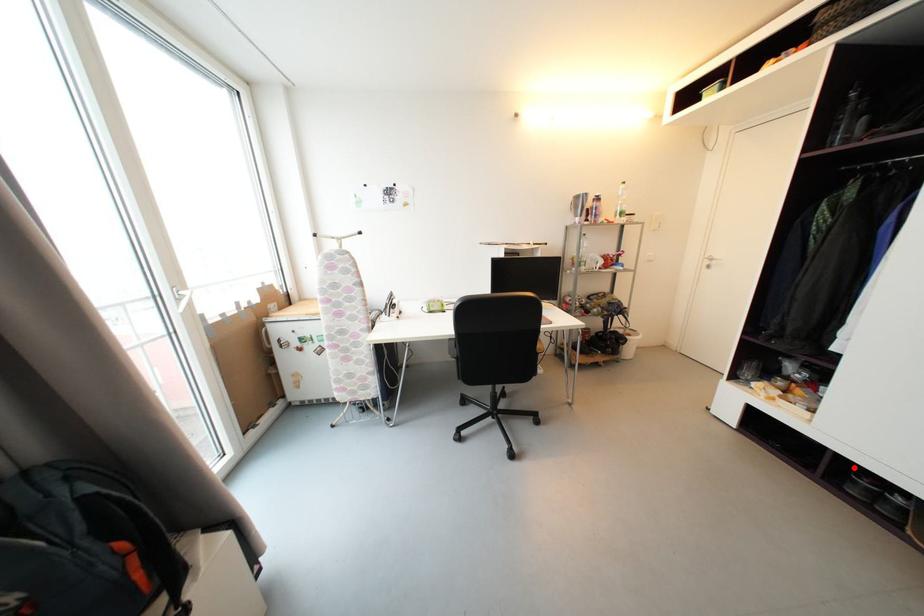
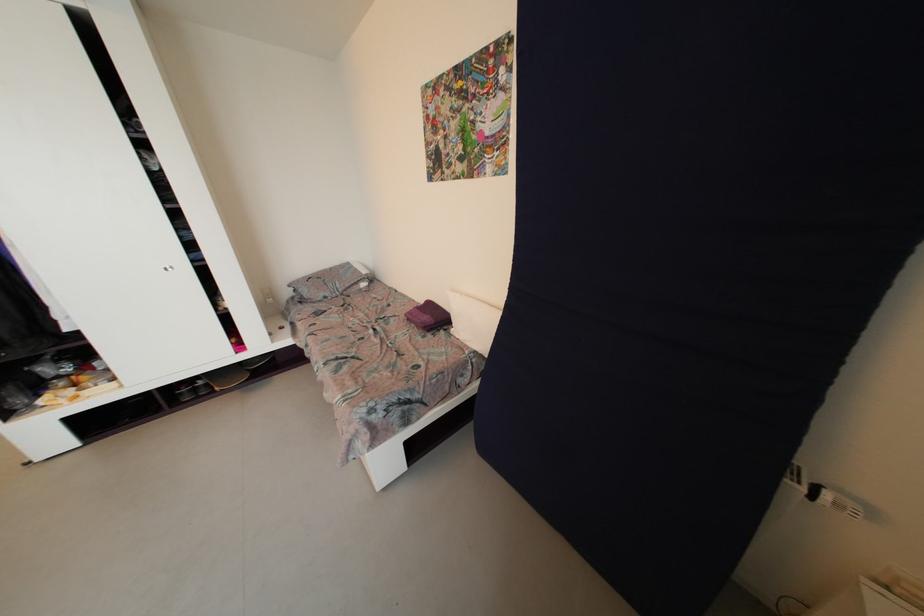
Locate, in the second image, the point that corresponds to the highlighted location in the first image.

(175, 391)